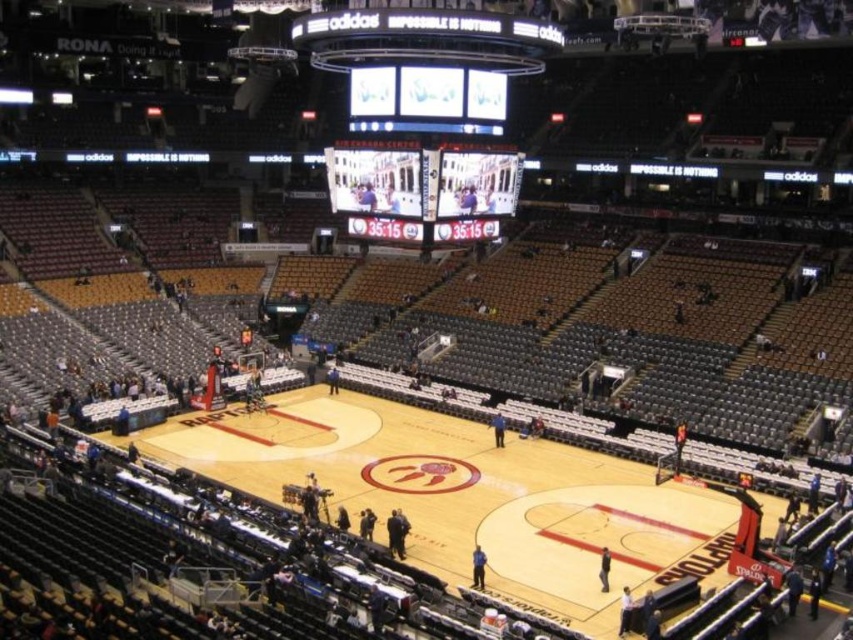
Can you confirm if wooden basketball court at center is smaller than led display at center?

No, wooden basketball court at center is not smaller than led display at center.

Who is shorter, wooden basketball court at center or led display at center?

led display at center is shorter.

The width and height of the screenshot is (853, 640). Find the location of `wooden basketball court at center`. wooden basketball court at center is located at coordinates (465, 493).